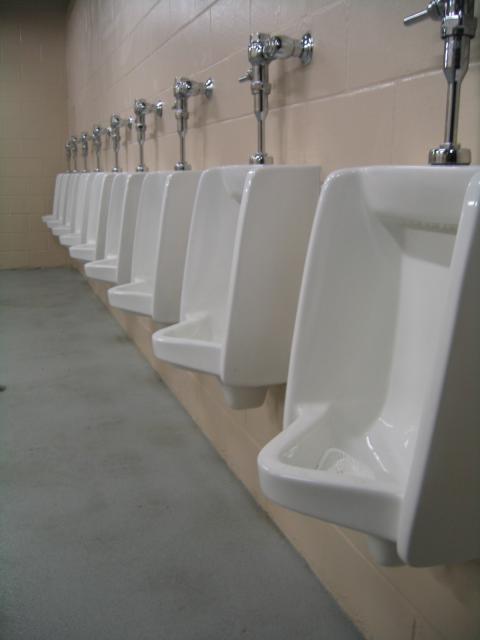
Where is `flushing handle`? The image size is (480, 640). flushing handle is located at coordinates (416, 18), (243, 77), (172, 106), (135, 116), (116, 125), (96, 138), (83, 141), (75, 145), (68, 148).